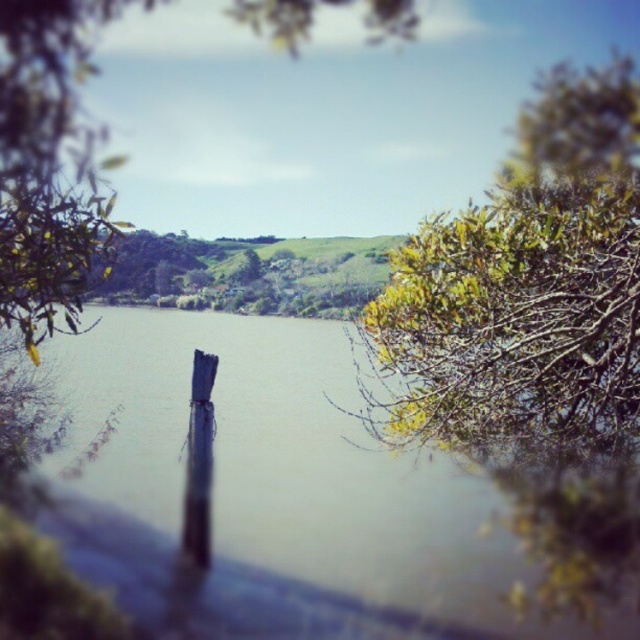
Is green leafy branches at upper right behind green leafy tree at center?

That is False.

Who is positioned more to the right, green leafy branches at upper right or green leafy tree at center?

green leafy branches at upper right is more to the right.

Is point (476, 237) closer to viewer compared to point (1, 86)?

Yes, it is.

At what (x,y) coordinates should I click in order to perform the action: click on green leafy branches at upper right. Please return your answer as a coordinate pair (x, y). Looking at the image, I should click on (528, 289).

Is green leafy tree at center closer to the viewer compared to green leafy tree at upper right?

Yes, green leafy tree at center is closer to the viewer.

Can you confirm if green leafy tree at center is bigger than green leafy tree at upper right?

No.

Find the location of a particular element. green leafy tree at center is located at coordinates (45, 92).

I want to click on green leafy tree at center, so click(45, 92).

Is brown wood post at center thinner than green leafy branches at upper right?

No, brown wood post at center is not thinner than green leafy branches at upper right.

Which of these two, brown wood post at center or green leafy branches at upper right, stands taller?

With more height is green leafy branches at upper right.

Image resolution: width=640 pixels, height=640 pixels. In order to click on brown wood post at center in this screenshot , I will do `click(273, 492)`.

Where is `brown wood post at center`? This screenshot has width=640, height=640. brown wood post at center is located at coordinates (273, 492).